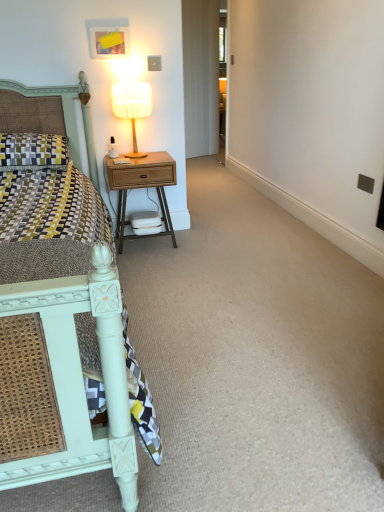
Describe the element at coordinates (64, 365) in the screenshot. I see `matte white bed at left` at that location.

What is the approximate height of white fabric lampshade at upper right?

17.86 inches.

You are a GUI agent. You are given a task and a screenshot of the screen. Output one action in this format:
    pyautogui.click(x=<x>, y=<y>)
    Task: Click on the patterned fabric pillow at left
    This screenshot has width=384, height=512.
    Given the screenshot: What is the action you would take?
    33,151

At what (x,y) coordinates should I click in order to perform the action: click on matte white bed at left. Please return your answer as a coordinate pair (x, y). This screenshot has height=512, width=384. Looking at the image, I should click on (64, 365).

From the image's perspective, is matte white bed at left above or below woodenmaterial/texturenightstand at left?

matte white bed at left is below woodenmaterial/texturenightstand at left.

Which object is further away from the camera taking this photo, matte white bed at left or woodenmaterial/texturenightstand at left?

woodenmaterial/texturenightstand at left is more distant.

Is matte white bed at left shorter than woodenmaterial/texturenightstand at left?

No.

Is point (40, 140) closer or farther from the camera than point (137, 109)?

Point (40, 140).

Considering the relative sizes of patterned fabric pillow at left and white fabric lampshade at upper right in the image provided, is patterned fabric pillow at left taller than white fabric lampshade at upper right?

No.

At what (x,y) coordinates should I click in order to perform the action: click on bedside lamp behind the patterned fabric pillow at left. Please return your answer as a coordinate pair (x, y). Looking at the image, I should click on (132, 106).

Does patterned fabric pillow at left turn towards white fabric lampshade at upper right?

No, patterned fabric pillow at left is not turned towards white fabric lampshade at upper right.

From a real-world perspective, which object rests below the other?

From a 3D spatial view, matte white bed at left is below.

Measure the distance between matte white bed at left and patterned fabric pillow at left.

The distance of matte white bed at left from patterned fabric pillow at left is 5.30 feet.

I want to click on bed below the patterned fabric pillow at left (from the image's perspective), so click(64, 365).

Considering the relative positions of matte white bed at left and patterned fabric pillow at left in the image provided, is matte white bed at left to the left or to the right of patterned fabric pillow at left?

From the image, it's evident that matte white bed at left is to the right of patterned fabric pillow at left.

Are matte white bed at left and white fabric lampshade at upper right far apart?

matte white bed at left is far away from white fabric lampshade at upper right.

Based on the photo, which object is thinner, matte white bed at left or white fabric lampshade at upper right?

With smaller width is white fabric lampshade at upper right.

Can you confirm if matte white bed at left is shorter than white fabric lampshade at upper right?

No, matte white bed at left is not shorter than white fabric lampshade at upper right.

Image resolution: width=384 pixels, height=512 pixels. What are the coordinates of `bed located below the white fabric lampshade at upper right (from the image's perspective)` in the screenshot? It's located at (64, 365).

Is white fabric lampshade at upper right facing towards patterned fabric pillow at left?

No, white fabric lampshade at upper right is not aimed at patterned fabric pillow at left.

The height and width of the screenshot is (512, 384). Find the location of `pillow below the white fabric lampshade at upper right (from a real-world perspective)`. pillow below the white fabric lampshade at upper right (from a real-world perspective) is located at coordinates (33, 151).

From the picture: Can you confirm if white fabric lampshade at upper right is taller than patterned fabric pillow at left?

Yes.

Is point (124, 93) behind point (1, 170)?

Yes, it is.

Is point (149, 156) less distant than point (144, 92)?

No, (149, 156) is further to viewer.

In the scene shown: Between woodenmaterial/texturenightstand at left and white fabric lampshade at upper right, which one has smaller width?

With smaller width is white fabric lampshade at upper right.

Who is bigger, woodenmaterial/texturenightstand at left or white fabric lampshade at upper right?

With larger size is woodenmaterial/texturenightstand at left.

Does woodenmaterial/texturenightstand at left turn towards white fabric lampshade at upper right?

No, woodenmaterial/texturenightstand at left does not turn towards white fabric lampshade at upper right.

In terms of height, does white fabric lampshade at upper right look taller or shorter compared to matte white bed at left?

Considering their sizes, white fabric lampshade at upper right has less height than matte white bed at left.

Is white fabric lampshade at upper right turned away from matte white bed at left?

No, white fabric lampshade at upper right's orientation is not away from matte white bed at left.

Which point is more distant from viewer, [143,88] or [81,82]?

The point [81,82] is behind.

Is white fabric lampshade at upper right inside or outside of matte white bed at left?

The correct answer is: outside.

The height and width of the screenshot is (512, 384). Identify the location of bed in front of the woodenmaterial/texturenightstand at left. (64, 365).

Find the location of a particular element. Image resolution: width=384 pixels, height=512 pixels. pillow on the left of white fabric lampshade at upper right is located at coordinates (33, 151).

Which object lies nearer to the anchor point patterned fabric pillow at left, woodenmaterial/texturenightstand at left or matte white bed at left?

Based on the image, woodenmaterial/texturenightstand at left appears to be nearer to patterned fabric pillow at left.

From the image, which object appears to be nearer to matte white bed at left, white fabric lampshade at upper right or patterned fabric pillow at left?

patterned fabric pillow at left is positioned closer to the anchor matte white bed at left.

Which object lies further to the anchor point woodenmaterial/texturenightstand at left, white fabric lampshade at upper right or patterned fabric pillow at left?

Among the two, patterned fabric pillow at left is located further to woodenmaterial/texturenightstand at left.

In the scene shown: From the image, which object appears to be nearer to patterned fabric pillow at left, woodenmaterial/texturenightstand at left or white fabric lampshade at upper right?

Among the two, woodenmaterial/texturenightstand at left is located nearer to patterned fabric pillow at left.

From the image, which object appears to be nearer to matte white bed at left, woodenmaterial/texturenightstand at left or patterned fabric pillow at left?

patterned fabric pillow at left.

Looking at the image, which one is located further to white fabric lampshade at upper right, patterned fabric pillow at left or matte white bed at left?

Among the two, matte white bed at left is located further to white fabric lampshade at upper right.

Based on their spatial positions, is patterned fabric pillow at left or white fabric lampshade at upper right closer to woodenmaterial/texturenightstand at left?

white fabric lampshade at upper right is positioned closer to the anchor woodenmaterial/texturenightstand at left.

Estimate the real-world distances between objects in this image. Which object is further from white fabric lampshade at upper right, matte white bed at left or woodenmaterial/texturenightstand at left?

The object further to white fabric lampshade at upper right is matte white bed at left.

You are a GUI agent. You are given a task and a screenshot of the screen. Output one action in this format:
    pyautogui.click(x=<x>, y=<y>)
    Task: Click on the pillow between matte white bed at left and white fabric lampshade at upper right from front to back
    
    Given the screenshot: What is the action you would take?
    pyautogui.click(x=33, y=151)

At what (x,y) coordinates should I click in order to perform the action: click on pillow positioned between matte white bed at left and woodenmaterial/texturenightstand at left from near to far. Please return your answer as a coordinate pair (x, y). Looking at the image, I should click on click(x=33, y=151).

The height and width of the screenshot is (512, 384). I want to click on bedside lamp between patterned fabric pillow at left and woodenmaterial/texturenightstand at left, so click(x=132, y=106).

Locate an element on the screen. bedside lamp between matte white bed at left and woodenmaterial/texturenightstand at left in the front-back direction is located at coordinates (132, 106).